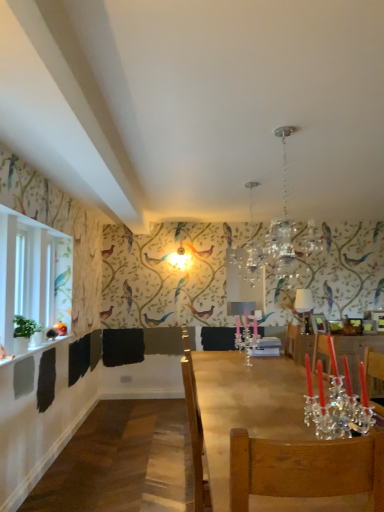
Where is `vacant area on top of crystal glass chandelier at upper center (from a real-world perspective)`? vacant area on top of crystal glass chandelier at upper center (from a real-world perspective) is located at coordinates (281, 133).